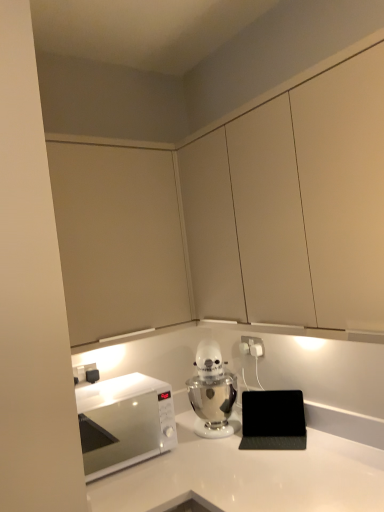
Question: Considering their positions, is white glossy countertop at center located in front of or behind white glossy microwave at left?

Choices:
 (A) front
 (B) behind

Answer: (A)

Question: Which is correct: white glossy countertop at center is inside white glossy microwave at left, or outside of it?

Choices:
 (A) inside
 (B) outside

Answer: (B)

Question: Which of these objects is positioned farthest from the white glossy microwave at left?

Choices:
 (A) matte beige cabinet at upper left, the first cabinetry from the left
 (B) matte white cabinets at upper center, positioned as the second cabinetry in left-to-right order
 (C) white glossy countertop at center
 (D) white plastic electric outlet at center-right
 (E) metallic silver stand mixer at center

Answer: (D)

Question: Which of these objects is positioned closest to the metallic silver stand mixer at center?

Choices:
 (A) white glossy countertop at center
 (B) white glossy microwave at left
 (C) matte white cabinets at upper center, which appears as the first cabinetry when viewed from the right
 (D) matte beige cabinet at upper left, the first cabinetry from the left
 (E) white plastic electric outlet at center-right

Answer: (E)